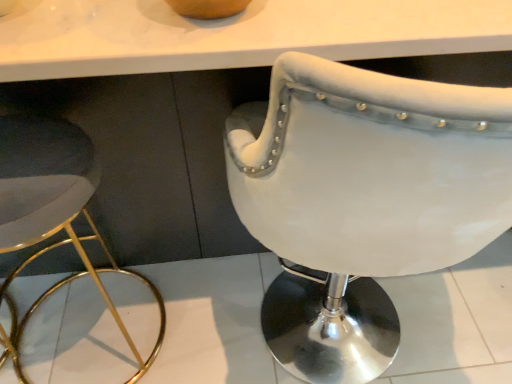
Where is `free spot to the right of white leather chair at center`? The height and width of the screenshot is (384, 512). free spot to the right of white leather chair at center is located at coordinates (455, 317).